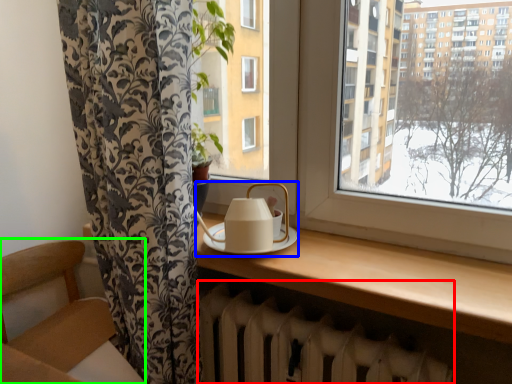
Question: Which is farther away from radiator (highlighted by a red box)? tea set (highlighted by a blue box) or armchair (highlighted by a green box)?

Choices:
 (A) tea set
 (B) armchair

Answer: (B)